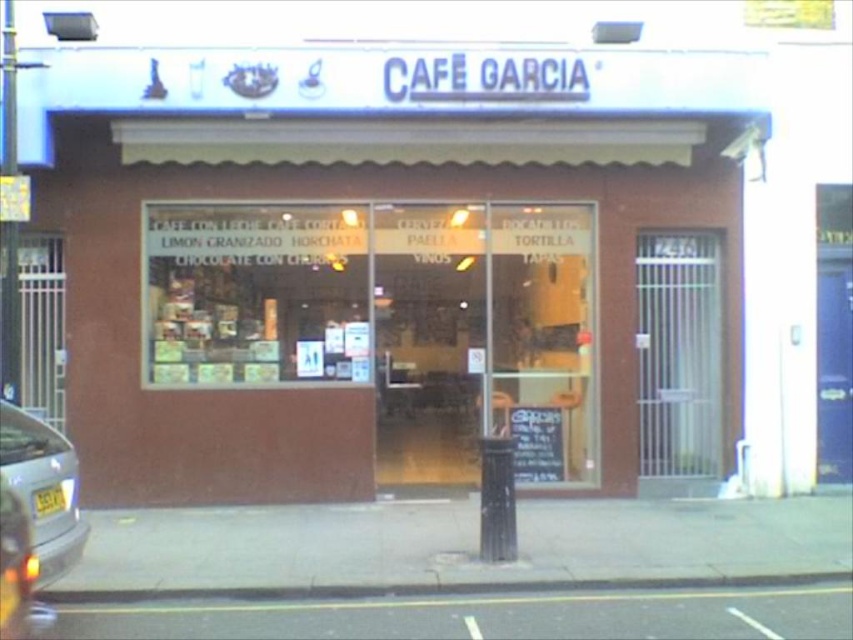
Does silver metallic car at lower left come behind black chalkboard at center?

No, silver metallic car at lower left is in front of black chalkboard at center.

Which is behind, point (73, 541) or point (561, 433)?

The point (561, 433) is behind.

Where is `silver metallic car at lower left`? silver metallic car at lower left is located at coordinates (44, 486).

The width and height of the screenshot is (853, 640). In order to click on silver metallic car at lower left in this screenshot , I will do `click(44, 486)`.

Between brown brick building at center and black asphalt curb at lower center, which one has more height?

brown brick building at center is taller.

Locate an element on the screen. This screenshot has height=640, width=853. brown brick building at center is located at coordinates (370, 252).

Identify the location of brown brick building at center. The width and height of the screenshot is (853, 640). (370, 252).

Is black asphalt curb at lower center below black chalkboard at center?

Yes.

Who is taller, black asphalt curb at lower center or black chalkboard at center?

black chalkboard at center

This screenshot has width=853, height=640. Find the location of `black asphalt curb at lower center`. black asphalt curb at lower center is located at coordinates (438, 588).

I want to click on black asphalt curb at lower center, so click(x=438, y=588).